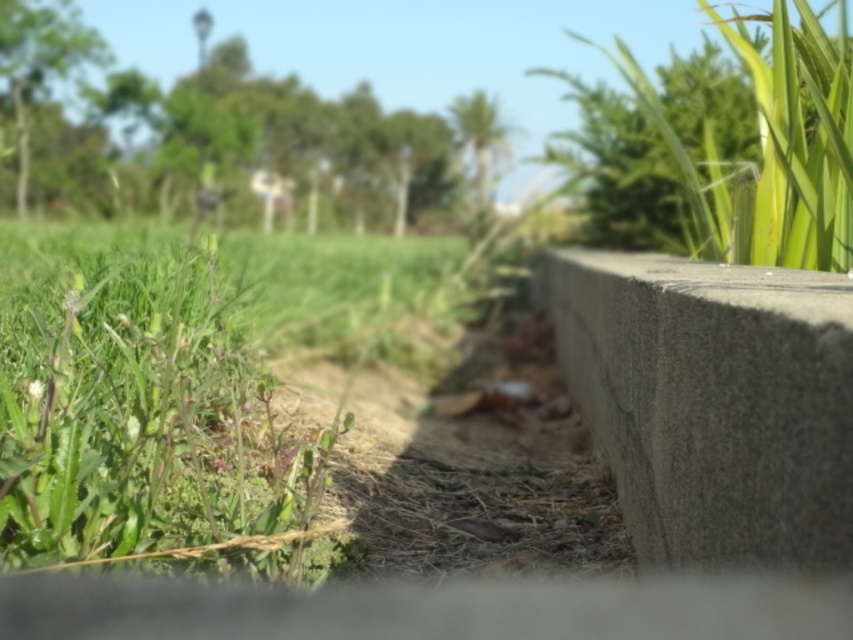
Can you confirm if green grass at left is taller than gray concrete at right?

Indeed, green grass at left has a greater height compared to gray concrete at right.

Can you confirm if green grass at left is bigger than gray concrete at right?

Correct, green grass at left is larger in size than gray concrete at right.

This screenshot has width=853, height=640. Describe the element at coordinates (144, 412) in the screenshot. I see `green grass at left` at that location.

The width and height of the screenshot is (853, 640). Identify the location of green grass at left. coord(144,412).